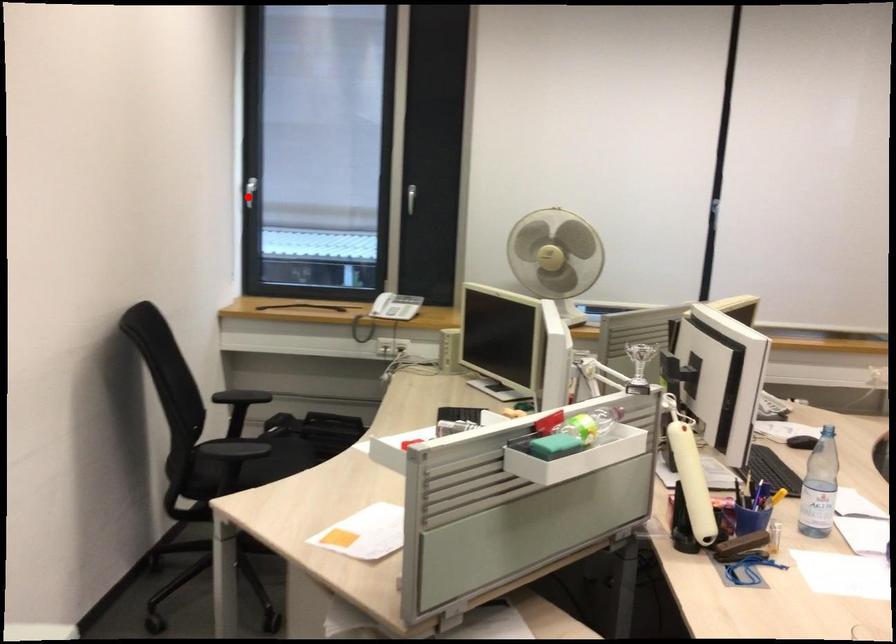
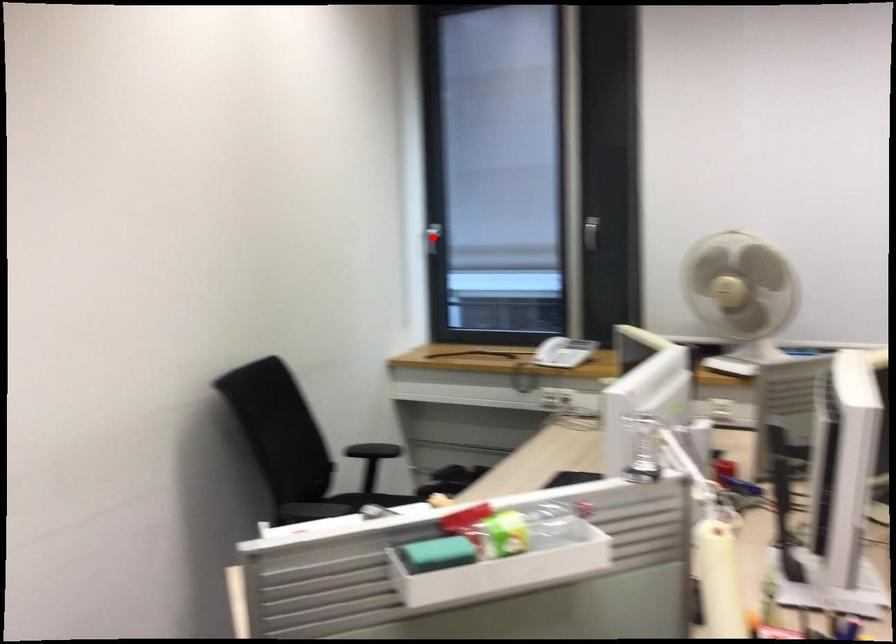
I am providing you with two images of the same scene from different viewpoints. A red point is marked on the first image and another point is marked on the second image. Do the highlighted points in image1 and image2 indicate the same real-world spot?

Yes